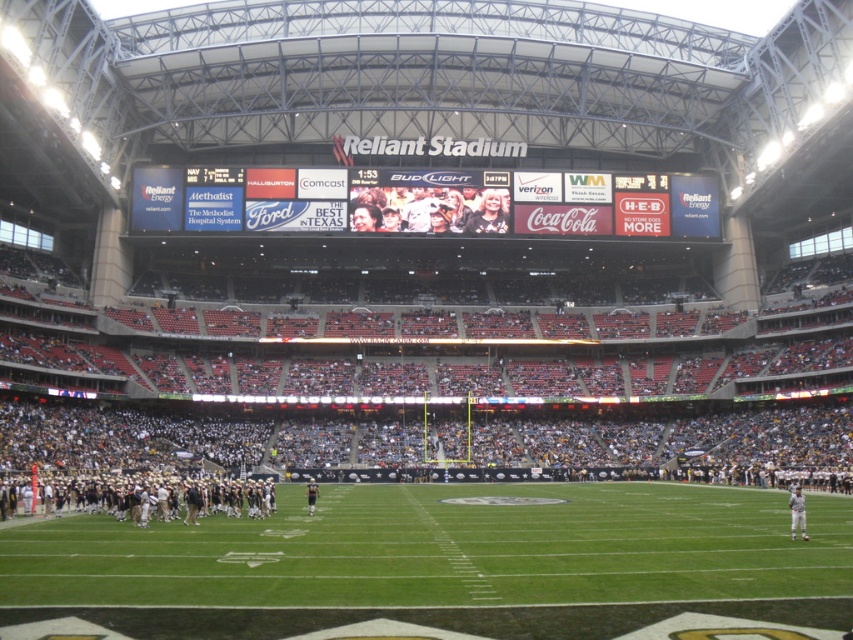
What do you see at coordinates (422, 202) in the screenshot? I see `white digital scoreboard at center` at bounding box center [422, 202].

Is white digital scoreboard at center smaller than dark gray uniformed players at lower left?

Actually, white digital scoreboard at center might be larger than dark gray uniformed players at lower left.

Is point (314, 211) positioned before point (84, 484)?

No, (314, 211) is further to viewer.

Locate an element on the screen. This screenshot has width=853, height=640. white digital scoreboard at center is located at coordinates (422, 202).